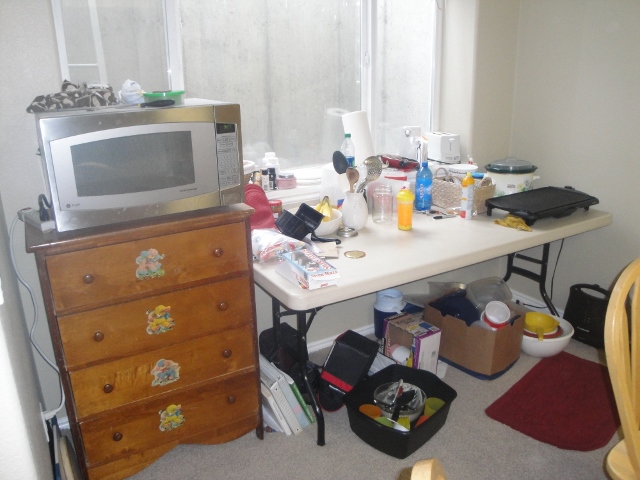
At what (x,y) coordinates should I click in order to perform the action: click on table leg. Please return your answer as a coordinate pair (x, y). Looking at the image, I should click on (303, 322), (541, 264).